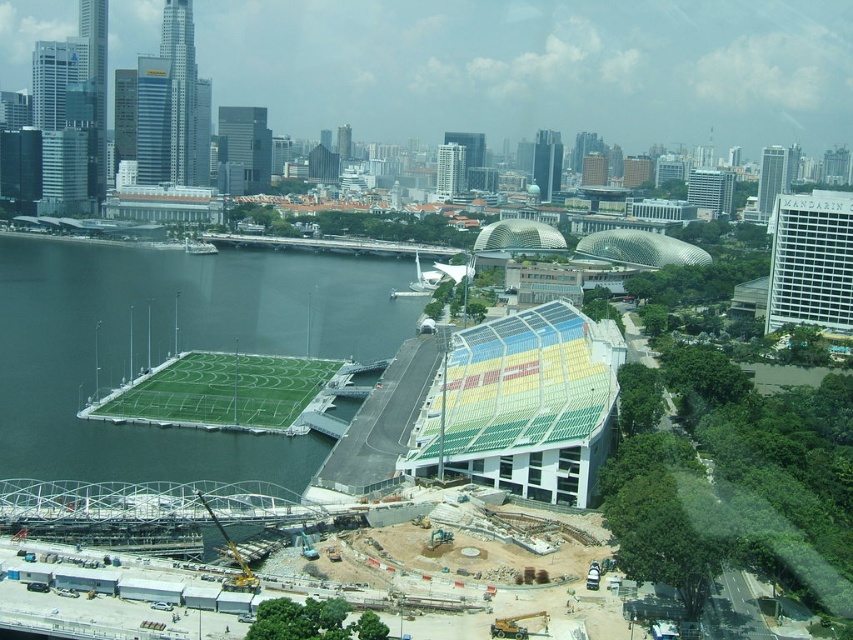
You are a city planner reviewing the construction site. You notice two areas of green artificial turf at left and green artificial turf at lower left. Which one has a bigger area?

The green artificial turf at left has a larger size compared to the green artificial turf at lower left.